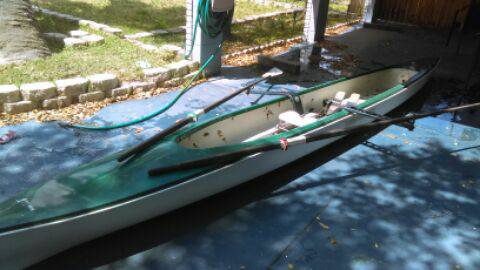
Image resolution: width=480 pixels, height=270 pixels. What are the coordinates of `seat` in the screenshot? It's located at (295, 120).